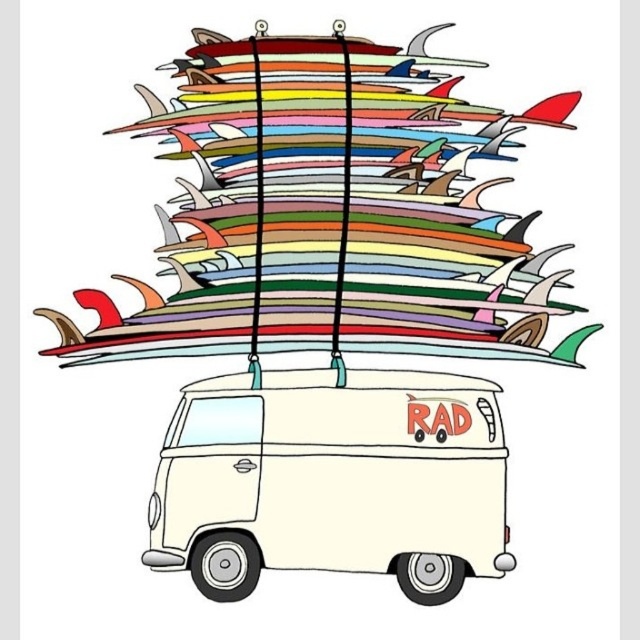
Can you confirm if multicolored surfboards at upper center is thinner than white matte van at center?

In fact, multicolored surfboards at upper center might be wider than white matte van at center.

Identify the location of multicolored surfboards at upper center. (332, 212).